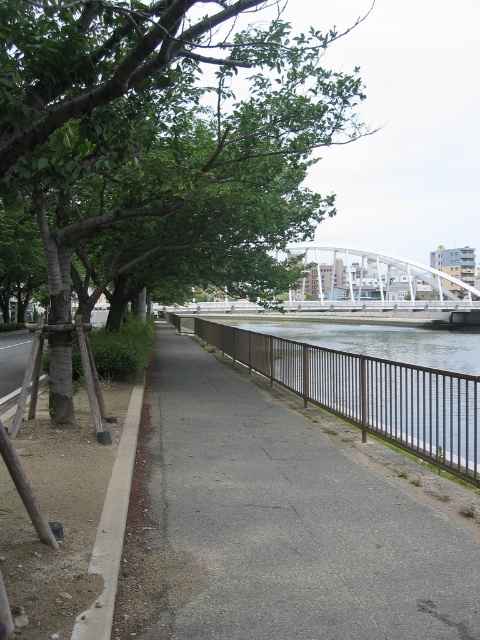
You are standing at the point marked as point (156, 124) on the riverside pathway. Looking around, you see a green leafy tree at upper left. Based on your position, which direction should you walk to reach the green leafy tree at upper left?

The green leafy tree at upper left is located at point (156, 124), which is your current position. Therefore, you are already at the location of the green leafy tree at upper left.

You are standing on the riverside pathway and want to place a small potted plant exactly at point (364, 392). What object will the potted plant be placed on or near?

The potted plant will be placed on or near the brown metal fence at center located at point (364, 392).

You are a pedestrian walking along the riverside pathway. You notice the green leafy tree at upper left and the brown metal fence at center. Which object is closer to you as you walk along the path?

The green leafy tree at upper left is closer to you because it is positioned in front of the brown metal fence at center, indicating it is nearer along your line of sight.